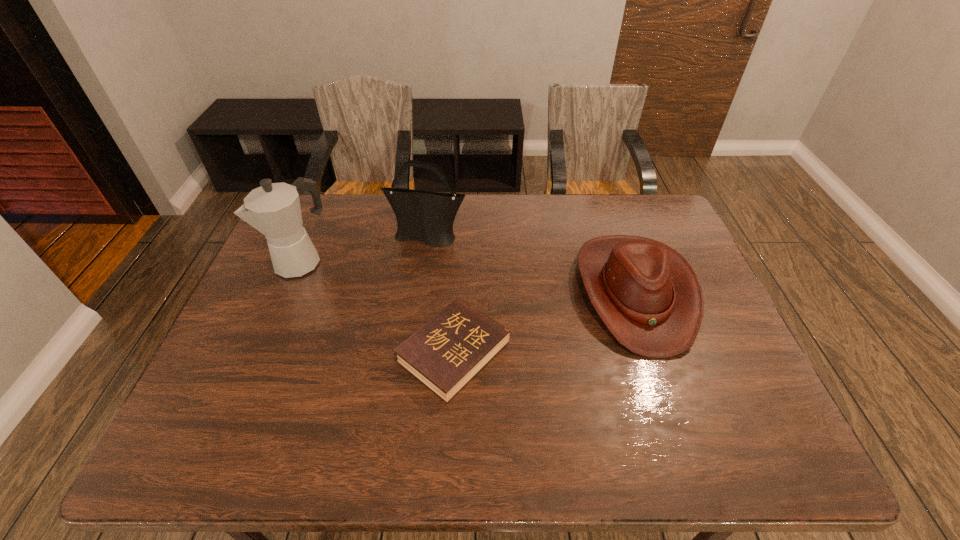
Locate an element on the screen. The width and height of the screenshot is (960, 540). unoccupied position between the hardback book and the coffeepot is located at coordinates (378, 307).

The image size is (960, 540). Find the location of `free space between the coffeepot and the cowboy hat`. free space between the coffeepot and the cowboy hat is located at coordinates (468, 276).

Find the location of a particular element. The image size is (960, 540). free space between the second shortest object and the shortest object is located at coordinates (544, 322).

This screenshot has height=540, width=960. What are the coordinates of `vacant space that is in between the shortest object and the second shortest object` in the screenshot? It's located at (544, 322).

Find the location of a particular element. unoccupied position between the shoulder bag and the leftmost object is located at coordinates (365, 249).

You are a GUI agent. You are given a task and a screenshot of the screen. Output one action in this format:
    pyautogui.click(x=<x>, y=<y>)
    Task: Click on the vacant point located between the shoulder bag and the cowboy hat
    The image size is (960, 540).
    Given the screenshot: What is the action you would take?
    pyautogui.click(x=531, y=265)

This screenshot has height=540, width=960. Find the location of `free spot between the rightmost object and the coffeepot`. free spot between the rightmost object and the coffeepot is located at coordinates (468, 276).

Locate which object is the closest to the hardback book. Please provide its 2D coordinates. Your answer should be formatted as a tuple, i.e. [(x, y)], where the tuple contains the x and y coordinates of a point satisfying the conditions above.

[(648, 296)]

Identify which object is the closest to the shoulder bag. Please provide its 2D coordinates. Your answer should be formatted as a tuple, i.e. [(x, y)], where the tuple contains the x and y coordinates of a point satisfying the conditions above.

[(273, 209)]

Where is `free space that satisfies the following two spatial constraints: 1. on the back side of the shoulder bag; 2. on the left side of the leftmost object`? free space that satisfies the following two spatial constraints: 1. on the back side of the shoulder bag; 2. on the left side of the leftmost object is located at coordinates (312, 238).